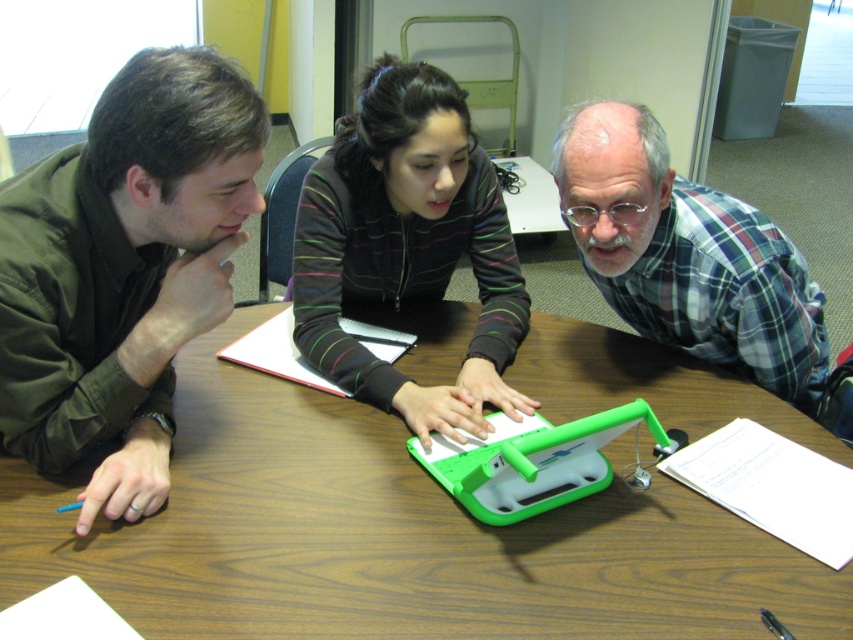
Question: Which object is positioned closest to the wooden table at center?

Choices:
 (A) striped fleece jacket at center
 (B) plaid flannel shirt at upper right
 (C) matte green shirt at left

Answer: (A)

Question: Does striped fleece jacket at center come in front of plaid flannel shirt at upper right?

Choices:
 (A) no
 (B) yes

Answer: (A)

Question: Can you confirm if wooden table at center is bigger than plaid flannel shirt at upper right?

Choices:
 (A) no
 (B) yes

Answer: (B)

Question: Considering the relative positions of wooden table at center and striped fleece jacket at center in the image provided, where is wooden table at center located with respect to striped fleece jacket at center?

Choices:
 (A) above
 (B) below

Answer: (B)

Question: Which of the following is the closest to the observer?

Choices:
 (A) striped fleece jacket at center
 (B) plaid flannel shirt at upper right
 (C) matte green shirt at left

Answer: (C)

Question: Which is farther from the matte green shirt at left?

Choices:
 (A) wooden table at center
 (B) plaid flannel shirt at upper right
 (C) striped fleece jacket at center

Answer: (B)